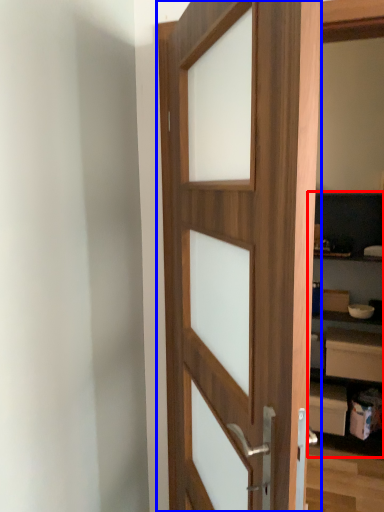
Question: Which object appears closest to the camera in this image, bookshelf (highlighted by a red box) or door (highlighted by a blue box)?

Choices:
 (A) bookshelf
 (B) door

Answer: (B)